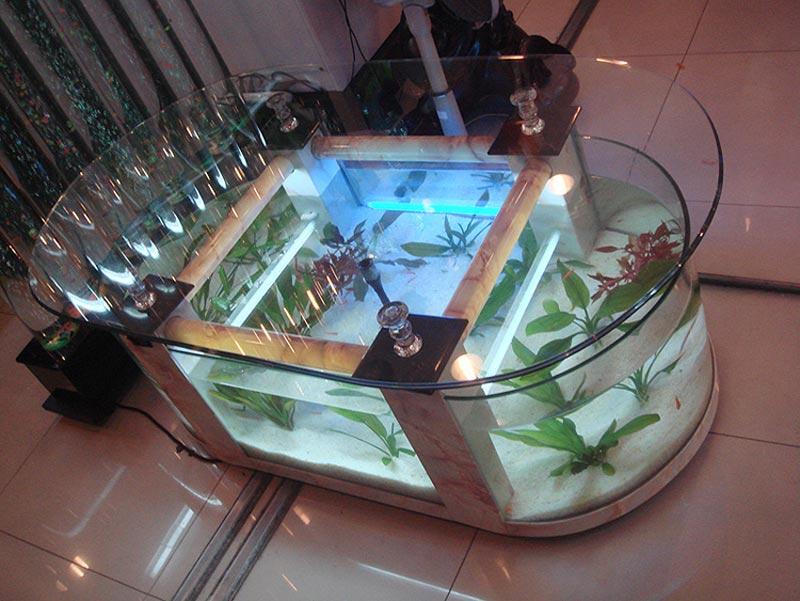
The image size is (800, 601). Identify the location of white tile floor. (668, 66).